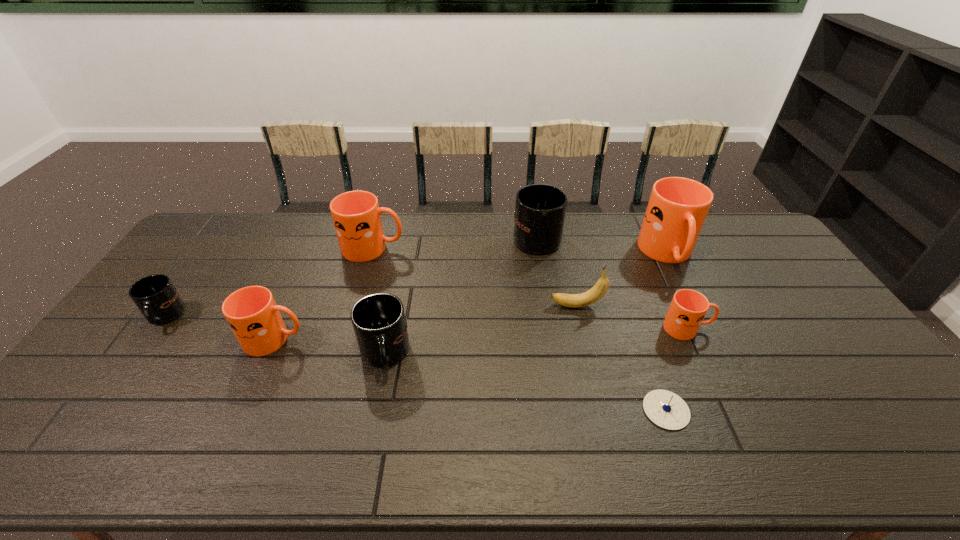
Locate an element on the screen. free space between the tallest object and the second smallest black mug is located at coordinates (526, 305).

The height and width of the screenshot is (540, 960). I want to click on free space between the yellow banana and the smallest orange mug, so click(632, 317).

Where is `vacant region between the third smallest orange mug and the shortest object`? vacant region between the third smallest orange mug and the shortest object is located at coordinates (519, 329).

I want to click on empty location between the second black mug from left to right and the smallest orange mug, so click(536, 341).

This screenshot has width=960, height=540. Find the location of `empty space between the third orange mug from right to left and the biggest orange mug`. empty space between the third orange mug from right to left and the biggest orange mug is located at coordinates (520, 252).

Where is `free space between the rightmost black mug and the second biggest orange mug`? The image size is (960, 540). free space between the rightmost black mug and the second biggest orange mug is located at coordinates (455, 242).

Where is `free space between the third orange mug from right to left and the tallest object`? free space between the third orange mug from right to left and the tallest object is located at coordinates (520, 252).

This screenshot has width=960, height=540. In order to click on vacant space that is in between the leftmost orange mug and the tallest mug in this screenshot , I will do `click(471, 297)`.

The height and width of the screenshot is (540, 960). I want to click on empty space that is in between the smallest orange mug and the rightmost black mug, so click(612, 282).

This screenshot has width=960, height=540. I want to click on free spot between the shortest object and the second black mug from left to right, so click(x=525, y=382).